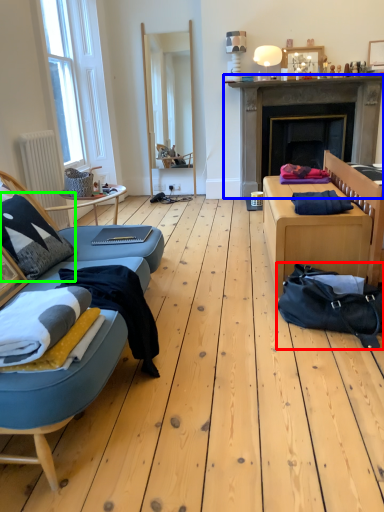
Question: Considering the real-world distances, which object is closest to bag (highlighted by a red box)? fireplace (highlighted by a blue box) or pillow (highlighted by a green box).

Choices:
 (A) fireplace
 (B) pillow

Answer: (B)